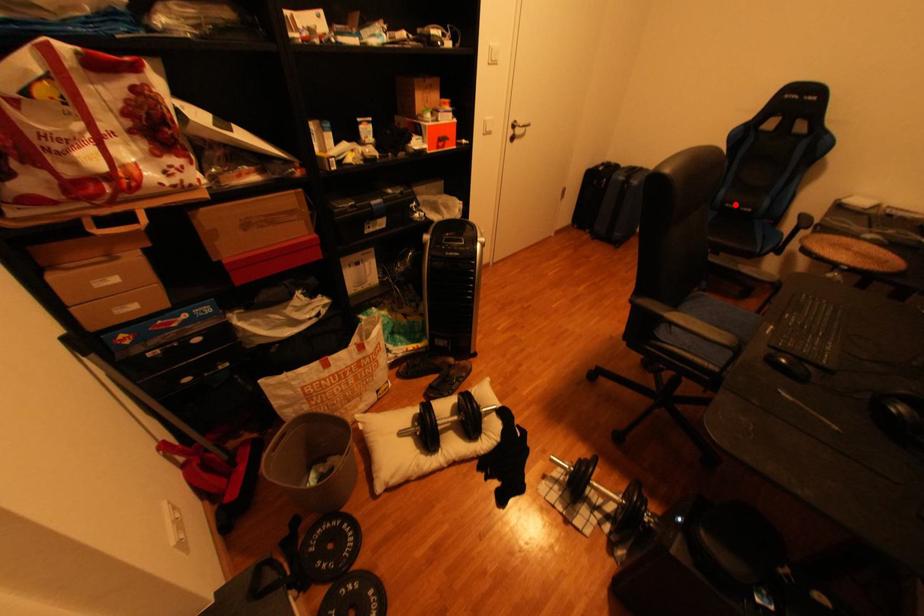
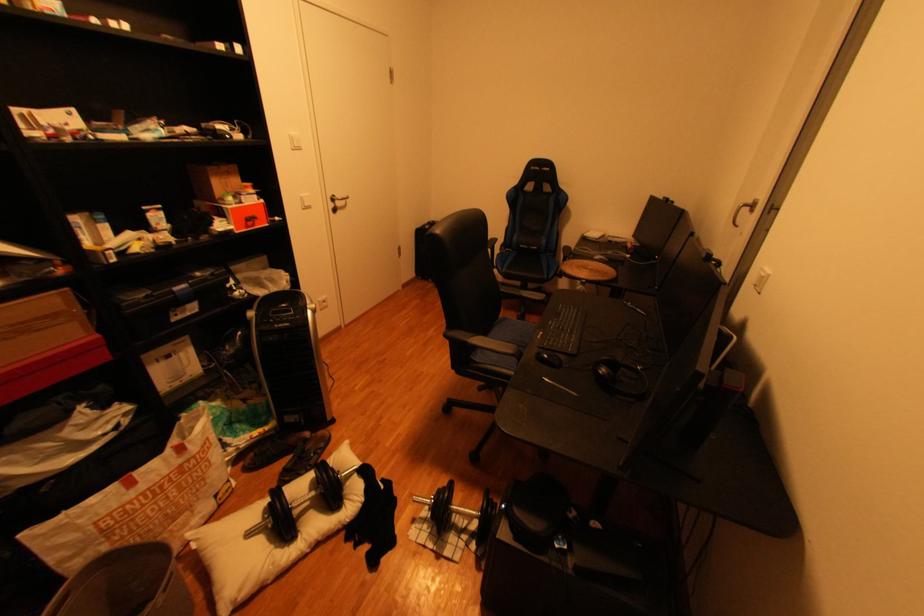
Locate, in the second image, the point that corresponds to the highlighted location in the first image.

(531, 246)